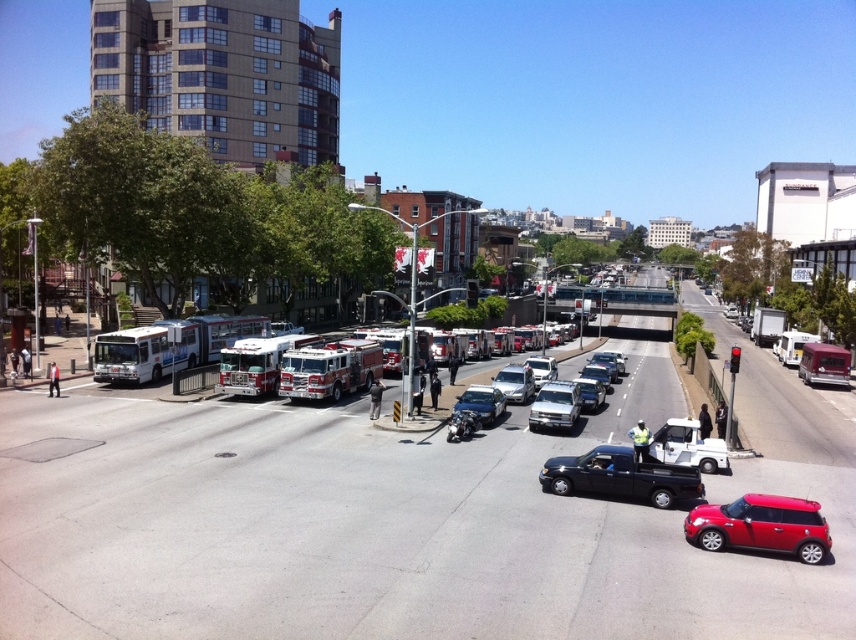
You are a delivery driver who needs to park your 2.5 meter tall truck. You see the black matte truck at center and the shiny silver fire truck at left. Which vehicle has enough vertical clearance for your truck?

The shiny silver fire truck at left is taller than the black matte truck at center. Since your truck is 2.5 meters tall, you should check the height of the shiny silver fire truck at left to ensure it provides sufficient clearance.

You are a delivery person who needs to load a tall package onto a truck. You see two trucks available in the scene, the black matte truck at center and the white matte truck at center. Which truck should you choose to ensure the package can fit inside?

The black matte truck at center has a greater height compared to the white matte truck at center, so you should choose the black matte truck at center to ensure the tall package can fit inside.

Consider the image. You are a pedestrian trying to cross the street safely. You see the black matte truck at center and the shiny silver fire truck at left. Which vehicle is directly above the other?

The black matte truck at center is positioned under the shiny silver fire truck at left, so the shiny silver fire truck at left is directly above it.